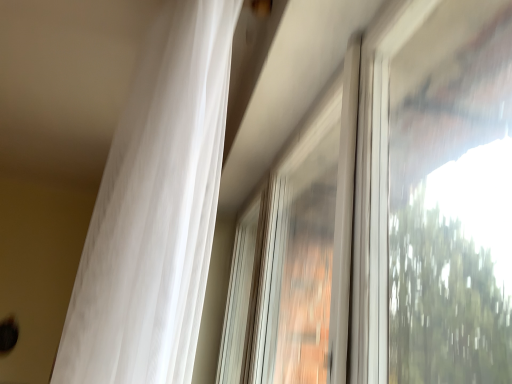
Find the location of a particular element. white sheer curtain at upper left is located at coordinates (155, 210).

What do you see at coordinates (155, 210) in the screenshot? I see `white sheer curtain at upper left` at bounding box center [155, 210].

This screenshot has height=384, width=512. Find the location of `white sheer curtain at upper left`. white sheer curtain at upper left is located at coordinates (155, 210).